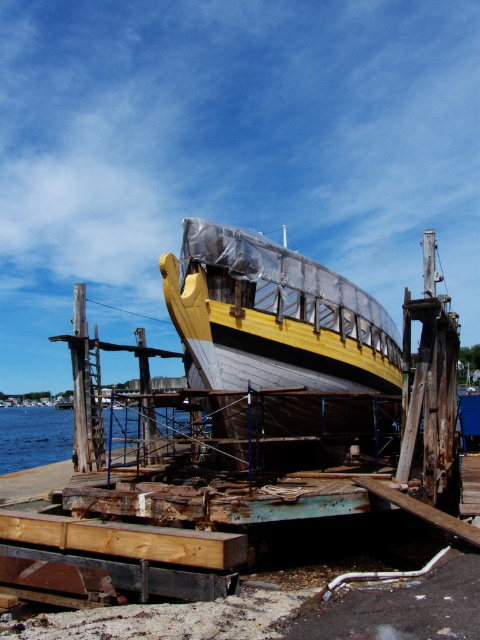
Describe the element at coordinates (274, 317) in the screenshot. I see `yellow wooden boat at center` at that location.

Identify the location of yellow wooden boat at center. (274, 317).

At what (x,y) coordinates should I click in order to perform the action: click on yellow wooden boat at center. Please return your answer as a coordinate pair (x, y). The height and width of the screenshot is (640, 480). Looking at the image, I should click on (274, 317).